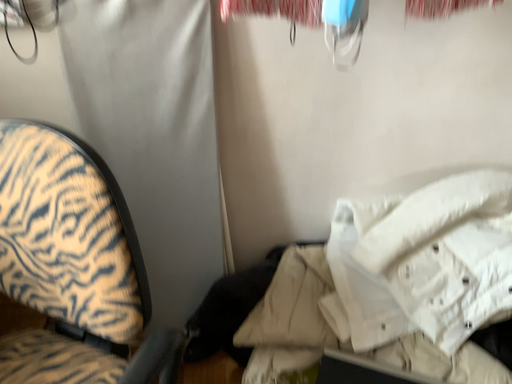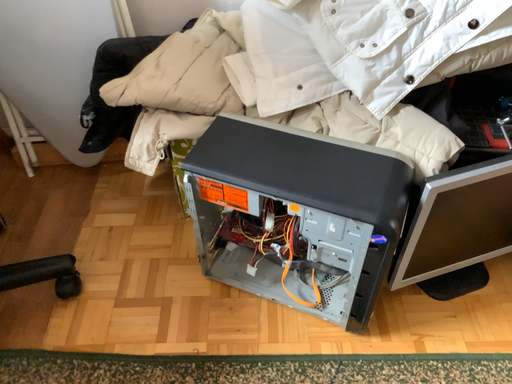
Question: Which way did the camera rotate in the video?

Choices:
 (A) rotated upward
 (B) rotated downward

Answer: (B)